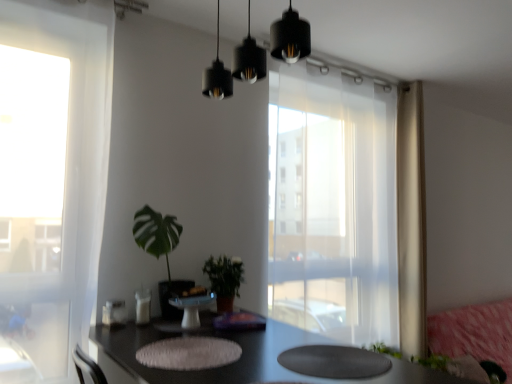
Question: Is transparent curtain at center not close to beige sheer curtain at right?

Choices:
 (A) yes
 (B) no

Answer: (B)

Question: From a real-world perspective, is transparent curtain at center physically below beige sheer curtain at right?

Choices:
 (A) yes
 (B) no

Answer: (A)

Question: Does transparent curtain at center appear on the right side of beige sheer curtain at right?

Choices:
 (A) yes
 (B) no

Answer: (B)

Question: Are transparent curtain at center and beige sheer curtain at right beside each other?

Choices:
 (A) yes
 (B) no

Answer: (B)

Question: Is beige sheer curtain at right at the back of transparent curtain at center?

Choices:
 (A) no
 (B) yes

Answer: (A)

Question: Is white glossy cake stand at center inside the boundaries of green leafy plant at center, positioned as the 1th houseplant in left-to-right order, or outside?

Choices:
 (A) inside
 (B) outside

Answer: (A)

Question: Based on their positions, is white glossy cake stand at center located to the left or right of green leafy plant at center, positioned as the second houseplant in right-to-left order?

Choices:
 (A) left
 (B) right

Answer: (B)

Question: Based on their sizes in the image, would you say white glossy cake stand at center is bigger or smaller than green leafy plant at center, positioned as the 1th houseplant in left-to-right order?

Choices:
 (A) small
 (B) big

Answer: (A)

Question: Does point (182, 317) appear closer or farther from the camera than point (169, 220)?

Choices:
 (A) farther
 (B) closer

Answer: (B)

Question: From the image's perspective, is green matte plant at center, the first houseplant viewed from the right, above or below black glossy table at center?

Choices:
 (A) above
 (B) below

Answer: (A)

Question: Would you say green matte plant at center, the first houseplant viewed from the right, is to the left or to the right of black glossy table at center in the picture?

Choices:
 (A) left
 (B) right

Answer: (A)

Question: From a real-world perspective, is green matte plant at center, which is counted as the 2th houseplant, starting from the left, physically located above or below black glossy table at center?

Choices:
 (A) above
 (B) below

Answer: (A)

Question: In the image, is green matte plant at center, the first houseplant viewed from the right, positioned in front of or behind black glossy table at center?

Choices:
 (A) front
 (B) behind

Answer: (B)

Question: Is point (457, 334) closer or farther from the camera than point (173, 231)?

Choices:
 (A) closer
 (B) farther

Answer: (B)

Question: From a real-world perspective, relative to green leafy plant at center, positioned as the 1th houseplant in left-to-right order, is pink fabric couch at lower right vertically above or below?

Choices:
 (A) below
 (B) above

Answer: (A)